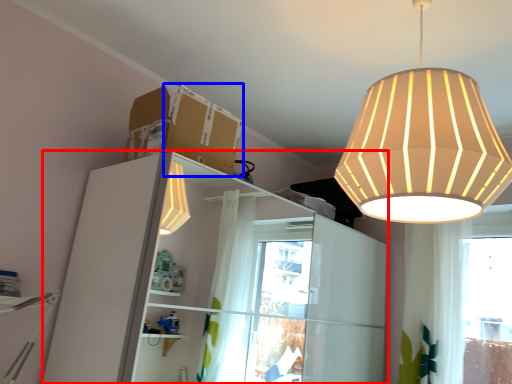
Question: Which object appears closest to the camera in this image, dresser (highlighted by a red box) or cardboard box (highlighted by a blue box)?

Choices:
 (A) dresser
 (B) cardboard box

Answer: (A)